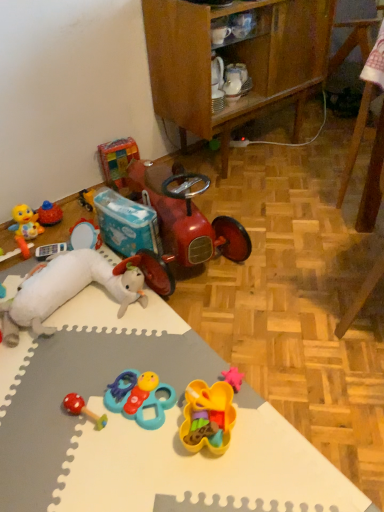
Question: Is plastic colorful blocks at upper left, which ranks as the 5th toy in front-to-back order, positioned with its back to rubberized red mushroom rattle at lower left, the 5th toy viewed from the top?

Choices:
 (A) no
 (B) yes

Answer: (A)

Question: Considering the relative sizes of plastic colorful blocks at upper left, which is counted as the fifth toy, starting from the bottom, and rubberized red mushroom rattle at lower left, the fourth toy when ordered from back to front, in the image provided, is plastic colorful blocks at upper left, which is counted as the fifth toy, starting from the bottom, taller than rubberized red mushroom rattle at lower left, the fourth toy when ordered from back to front,?

Choices:
 (A) no
 (B) yes

Answer: (B)

Question: Considering the relative positions of plastic colorful blocks at upper left, which ranks as the 5th toy in front-to-back order, and rubberized red mushroom rattle at lower left, the 5th toy viewed from the top, in the image provided, is plastic colorful blocks at upper left, which ranks as the 5th toy in front-to-back order, to the right of rubberized red mushroom rattle at lower left, the 5th toy viewed from the top, from the viewer's perspective?

Choices:
 (A) yes
 (B) no

Answer: (B)

Question: Can rubberized red mushroom rattle at lower left, the 2th toy in the front-to-back sequence, be found inside plastic colorful blocks at upper left, which is counted as the fifth toy, starting from the bottom?

Choices:
 (A) no
 (B) yes

Answer: (A)

Question: Is plastic colorful blocks at upper left, which ranks as the 5th toy in front-to-back order, not inside rubberized red mushroom rattle at lower left, the 2th toy in the front-to-back sequence?

Choices:
 (A) no
 (B) yes

Answer: (B)

Question: Looking at their shapes, would you say white plush toy at lower left, positioned as the 2th toy in back-to-front order, is wider or thinner than teal plastic toy at center, the third toy in the bottom-to-top sequence?

Choices:
 (A) wide
 (B) thin

Answer: (A)

Question: From the image's perspective, is white plush toy at lower left, the 2th toy from the top, positioned above or below teal plastic toy at center, the third toy in the bottom-to-top sequence?

Choices:
 (A) below
 (B) above

Answer: (B)

Question: Is white plush toy at lower left, positioned as the 4th toy in bottom-to-top order, taller or shorter than teal plastic toy at center, which ranks as the 3th toy in top-to-bottom order?

Choices:
 (A) tall
 (B) short

Answer: (A)

Question: Is white plush toy at lower left, the 2th toy from the top, situated inside teal plastic toy at center, the third toy in the bottom-to-top sequence, or outside?

Choices:
 (A) inside
 (B) outside

Answer: (B)

Question: In terms of height, does shiny red toy car at center look taller or shorter compared to white foam mat at lower left?

Choices:
 (A) tall
 (B) short

Answer: (A)

Question: In terms of size, does shiny red toy car at center appear bigger or smaller than white foam mat at lower left?

Choices:
 (A) small
 (B) big

Answer: (B)

Question: From the image's perspective, is shiny red toy car at center above or below white foam mat at lower left?

Choices:
 (A) below
 (B) above

Answer: (B)

Question: Relative to white foam mat at lower left, is shiny red toy car at center in front or behind?

Choices:
 (A) behind
 (B) front

Answer: (A)

Question: Is teal plastic toy at center, the third toy in the bottom-to-top sequence, bigger or smaller than wooden cabinet at center?

Choices:
 (A) big
 (B) small

Answer: (B)

Question: Does point (134, 385) appear closer or farther from the camera than point (264, 70)?

Choices:
 (A) farther
 (B) closer

Answer: (B)